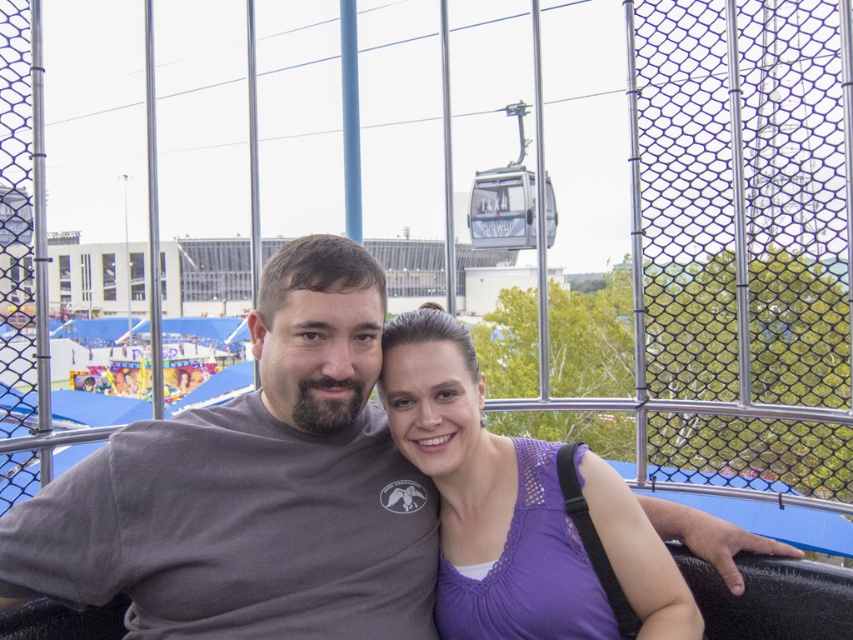
You are designing a new gondola car and need to ensure there is enough space between seats for passengers. The gray matte shirt at center and purple lace top at center are sitting side by side. Which passenger requires more horizontal space due to their clothing?

The gray matte shirt at center requires more horizontal space because its width surpasses that of the purple lace top at center.

You are a photographer positioned outside the gondola. You want to take a closeup of the purple lace top at center without including the gray T shirt. Is the distance sufficient for your camera which has a 100mm lens capable of zooming up to 3x? Explain.

The purple lace top at center is 5.30 meters from the camera. With a 100mm lens at 3x zoom, the effective focal length becomes 300mm. This allows the camera to capture a closeup of the purple lace top at center from 5.30 meters away without needing to move closer, so yes, the distance is sufficient.

You are a photographer standing inside the gondola. You want to take a photo of the metal cable car at upper center without including the gray matte shirt at center in the frame. Is it possible to adjust your position to achieve this?

The gray matte shirt at center is to the left of the metal cable car at upper center, so by moving to the right side of the gondola, you can position yourself so that the metal cable car at upper center is in the frame while excluding the gray matte shirt at center.